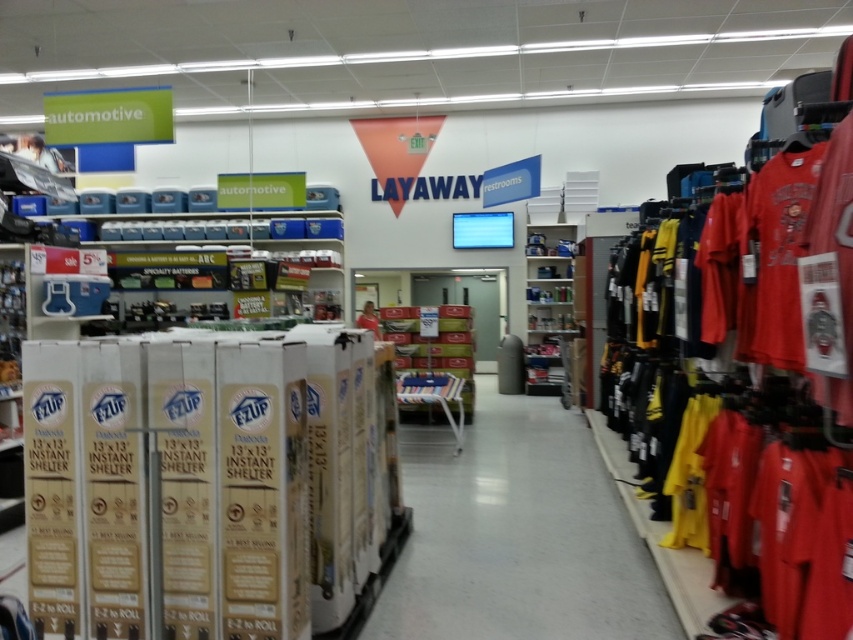
Is point (503, 552) closer to viewer compared to point (531, 300)?

Yes.

Between yellow fabric at center and metallic silver shelves at center, which one is positioned higher?

metallic silver shelves at center is above.

Is point (578, 445) positioned after point (537, 280)?

No.

This screenshot has width=853, height=640. I want to click on yellow fabric at center, so click(x=517, y=534).

Between point (793, 275) and point (567, 246), which one is positioned behind?

Point (567, 246)

Find the location of `matte red t-shirt at right`. matte red t-shirt at right is located at coordinates (776, 256).

From the picture: Can you confirm if yellow fabric at center is thinner than matte red t-shirt at right?

No, yellow fabric at center is not thinner than matte red t-shirt at right.

Identify the location of yellow fabric at center. The image size is (853, 640). (517, 534).

Is point (502, 554) positioned behind point (790, 346)?

Yes, it is.

Locate an element on the screen. This screenshot has height=640, width=853. yellow fabric at center is located at coordinates [x=517, y=534].